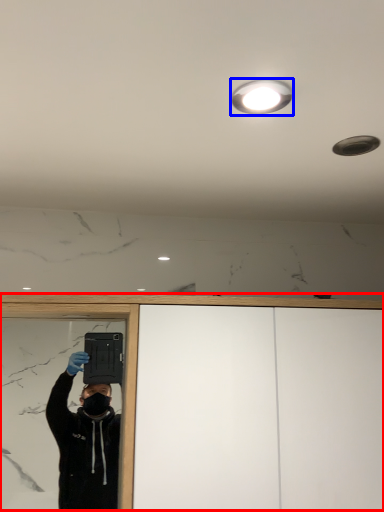
Question: Among these objects, which one is farthest to the camera, dresser (highlighted by a red box) or droplight (highlighted by a blue box)?

Choices:
 (A) dresser
 (B) droplight

Answer: (A)